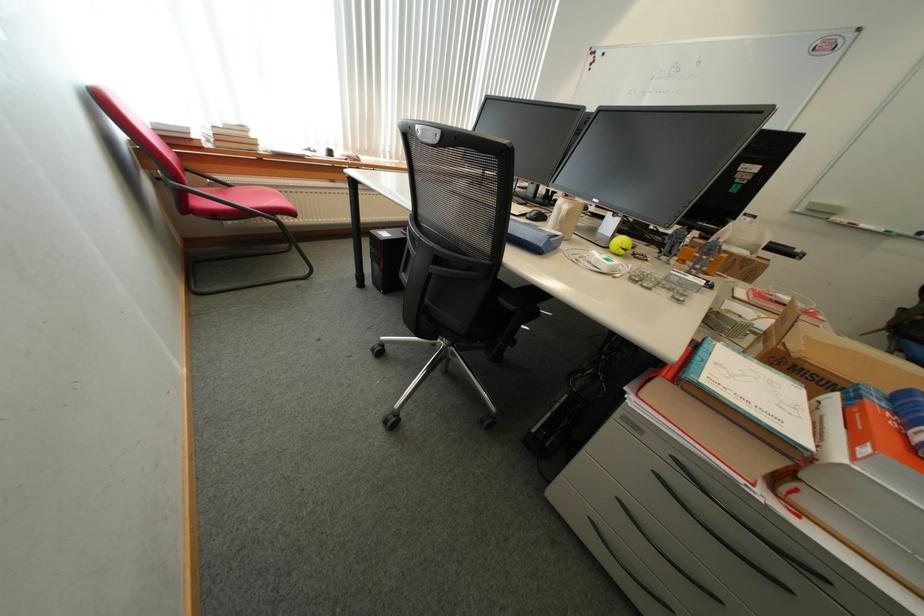
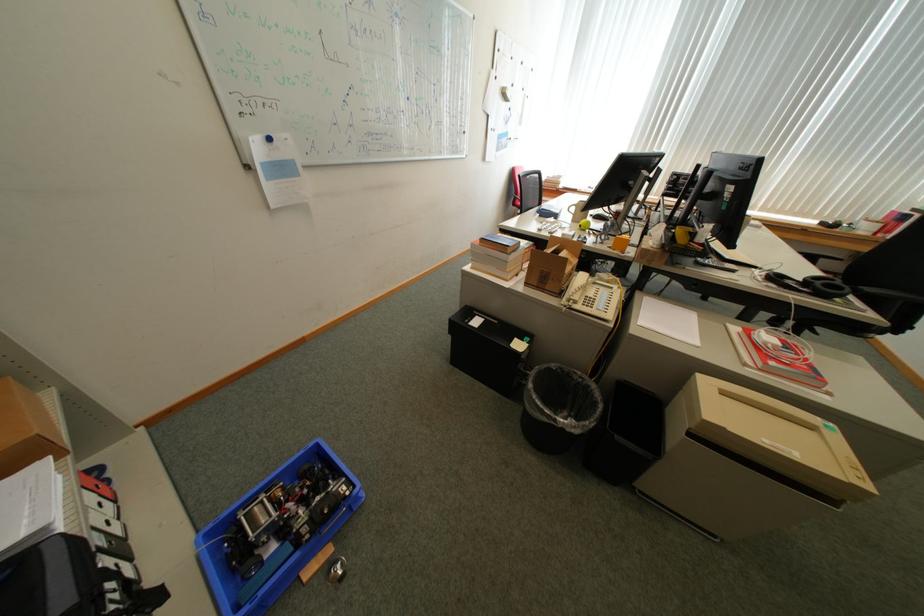
Question: I am providing you with two images of the same scene from different viewpoints. After the viewpoint changes to image2, which objects are now occluded?

Choices:
 (A) red chair sitting surface
 (B) white binder spine
 (C) orange fire extinguisher
 (D) red binder spine

Answer: (A)